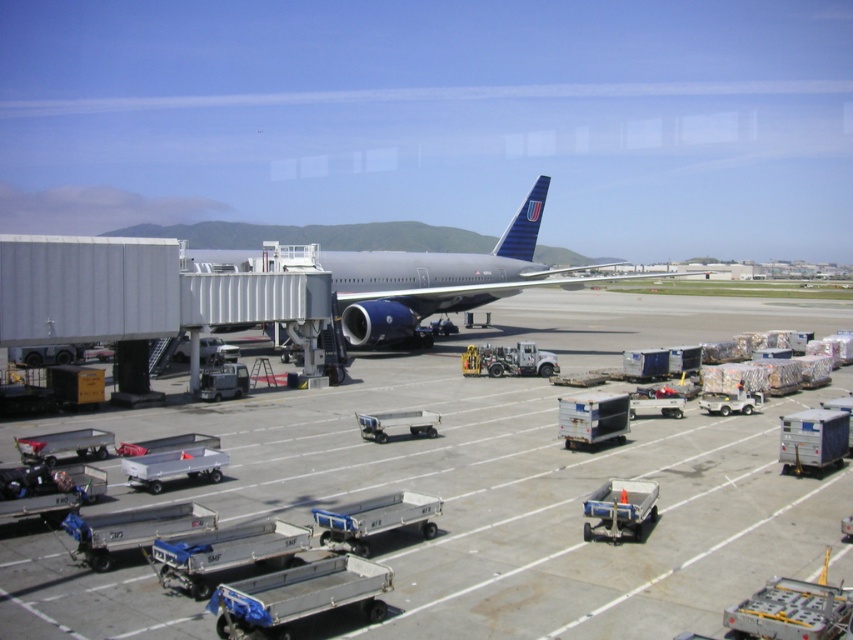
Question: Which of the following is the closest to the observer?

Choices:
 (A) metallic gray airplane at center
 (B) metallic gray tarmac at center

Answer: (B)

Question: Is metallic gray tarmac at center to the left of metallic gray airplane at center from the viewer's perspective?

Choices:
 (A) yes
 (B) no

Answer: (B)

Question: Is metallic gray tarmac at center above metallic gray airplane at center?

Choices:
 (A) yes
 (B) no

Answer: (B)

Question: Does metallic gray tarmac at center have a larger size compared to metallic gray airplane at center?

Choices:
 (A) no
 (B) yes

Answer: (A)